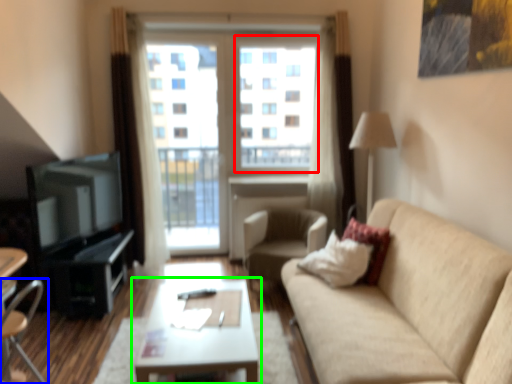
Question: Which is nearer to the window screen (highlighted by a red box)? chair (highlighted by a blue box) or coffee table (highlighted by a green box).

Choices:
 (A) chair
 (B) coffee table

Answer: (B)